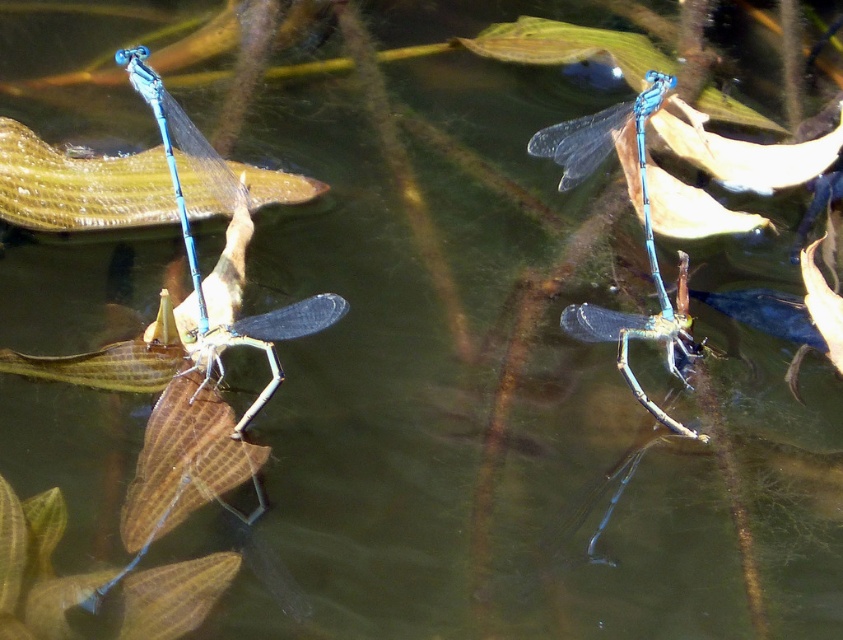
You are a photographer trying to capture a closeup of the transparent blue dragonfly at center and the blue translucent wings at center. Since your camera can only focus on objects within 15 inches of each other, will you be able to take a clear photo of both?

The blue translucent wings at center is 15.17 inches from transparent blue dragonfly at center. Since the distance between them is slightly over 15 inches, the camera cannot focus on both simultaneously, so the photo won

Based on the photo, you are a nature photographer observing the dragonflies in the water. You notice the blue translucent wings at center and the transparent blue dragonfly at center. Which object is positioned higher in the water?

The blue translucent wings at center is positioned higher in the water than the transparent blue dragonfly at center.

You are a photographer aiming to capture the dragonflies on the water surface. You notice a point at coordinates (221, 252) which marks the blue translucent wings at center. How would you describe the position of the blue translucent wings at center relative to the point?

The point (221, 252) marks the exact location of the blue translucent wings at center, so they are positioned precisely at that coordinate.